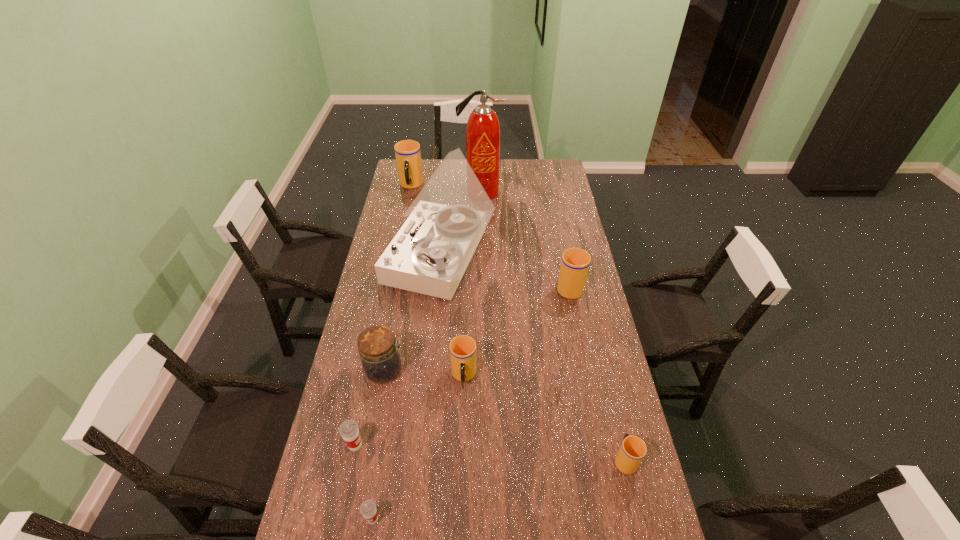
In order to click on the left red cup in this screenshot , I will do `click(349, 430)`.

Locate an element on the screen. Image resolution: width=960 pixels, height=540 pixels. the third farthest cup is located at coordinates (462, 348).

Locate an element on the screen. This screenshot has width=960, height=540. the second beige cup from left to right is located at coordinates (462, 348).

Where is `the smallest beige cup`? The width and height of the screenshot is (960, 540). the smallest beige cup is located at coordinates (633, 449).

Image resolution: width=960 pixels, height=540 pixels. I want to click on the nearer red cup, so click(368, 508).

Identify the location of the nearest cup. (368, 508).

Find the location of `vacant space located on the left of the fire extinguisher`. vacant space located on the left of the fire extinguisher is located at coordinates (399, 192).

You are a GUI agent. You are given a task and a screenshot of the screen. Output one action in this format:
    pyautogui.click(x=<x>, y=<y>)
    Task: Click on the vacant area situated 0.120m on the back of the record player
    Image resolution: width=960 pixels, height=540 pixels.
    Given the screenshot: What is the action you would take?
    pyautogui.click(x=445, y=205)

Where is `free location located 0.250m on the side of the farthest cup with the handle`? free location located 0.250m on the side of the farthest cup with the handle is located at coordinates (403, 225).

Image resolution: width=960 pixels, height=540 pixels. Find the location of `vacant region located on the side of the third smallest beige cup with the handle`. vacant region located on the side of the third smallest beige cup with the handle is located at coordinates (558, 228).